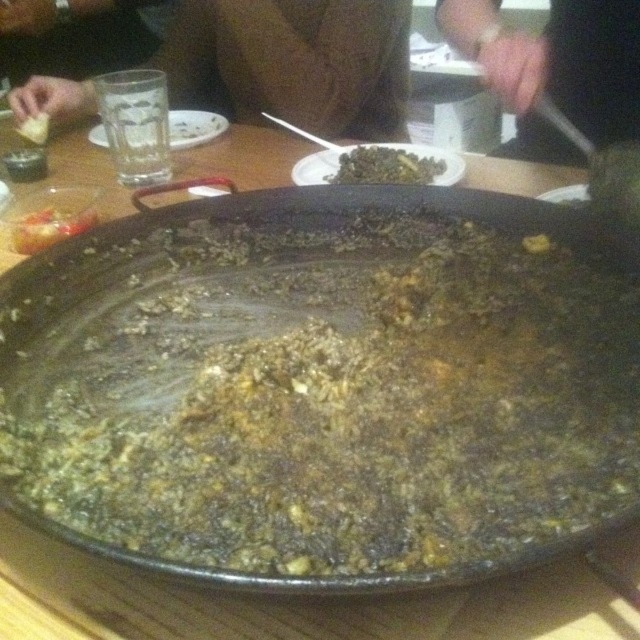
Question: Does black matte wok at center appear over white crumbly food at center?

Choices:
 (A) yes
 (B) no

Answer: (B)

Question: Is brown leather jacket at upper center above white crumbly food at center?

Choices:
 (A) yes
 (B) no

Answer: (A)

Question: Which is farther from the shiny plastic fork at upper left?

Choices:
 (A) black leather wristband at upper center
 (B) green matte rice at center
 (C) white crumbly food at center

Answer: (A)

Question: Is shiny plastic fork at upper left smaller than white crumbly food at center?

Choices:
 (A) no
 (B) yes

Answer: (A)

Question: Estimate the real-world distances between objects in this image. Which object is closer to the brown leather jacket at upper center?

Choices:
 (A) white crumbly food at center
 (B) green matte rice at center
 (C) black leather wristband at upper center

Answer: (B)

Question: Which object is the farthest from the shiny plastic fork at upper left?

Choices:
 (A) black leather wristband at upper center
 (B) black matte wok at center

Answer: (A)